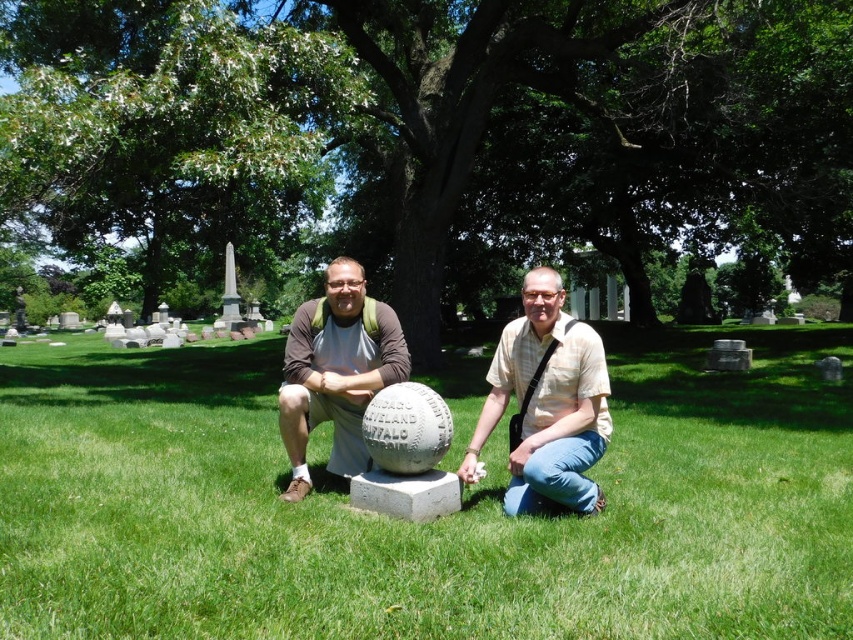
Question: Is green grass at center to the left of matte brown baseball at center from the viewer's perspective?

Choices:
 (A) yes
 (B) no

Answer: (B)

Question: Which point is farther to the camera?

Choices:
 (A) light brown textured shirt at center
 (B) green grass at center
 (C) matte brown baseball at center
 (D) white stone baseball at center

Answer: (C)

Question: Can you confirm if light brown textured shirt at center is positioned to the left of matte brown baseball at center?

Choices:
 (A) no
 (B) yes

Answer: (A)

Question: Which point is farther to the camera?

Choices:
 (A) light brown textured shirt at center
 (B) matte brown baseball at center
 (C) white stone baseball at center

Answer: (B)

Question: Observing the image, what is the correct spatial positioning of green grass at center in reference to light brown textured shirt at center?

Choices:
 (A) right
 (B) left

Answer: (B)

Question: Among these objects, which one is nearest to the camera?

Choices:
 (A) white stone baseball at center
 (B) matte brown baseball at center

Answer: (A)